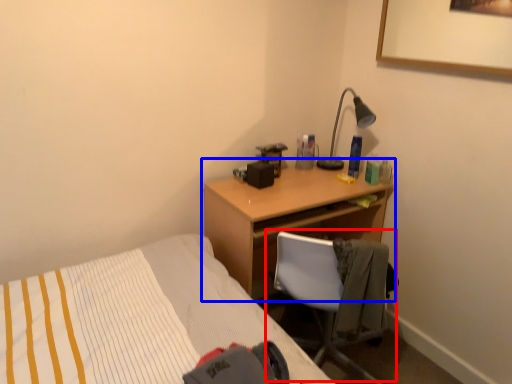
Question: Which object appears closest to the camera in this image, chair (highlighted by a red box) or desk (highlighted by a blue box)?

Choices:
 (A) chair
 (B) desk

Answer: (A)